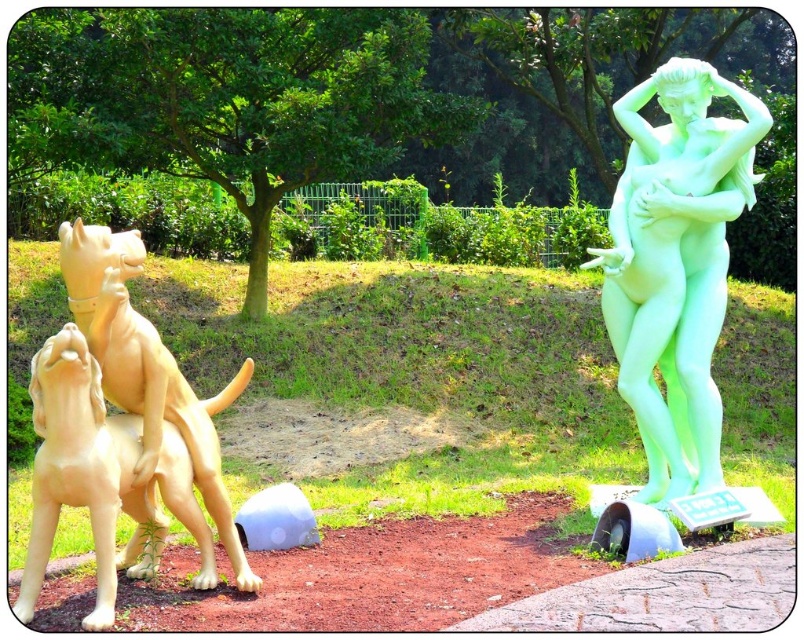
Question: Does green translucent statue at right appear on the right side of matte yellow dog at left?

Choices:
 (A) no
 (B) yes

Answer: (B)

Question: Is green translucent statue at right above matte yellow dog at left?

Choices:
 (A) yes
 (B) no

Answer: (A)

Question: Which of the following is the closest to the observer?

Choices:
 (A) green translucent statue at right
 (B) matte yellow dog at left

Answer: (B)

Question: Can you confirm if green translucent statue at right is positioned above matte yellow dog at left?

Choices:
 (A) no
 (B) yes

Answer: (B)

Question: Among these objects, which one is nearest to the camera?

Choices:
 (A) matte yellow dog at left
 (B) green translucent statue at right

Answer: (A)